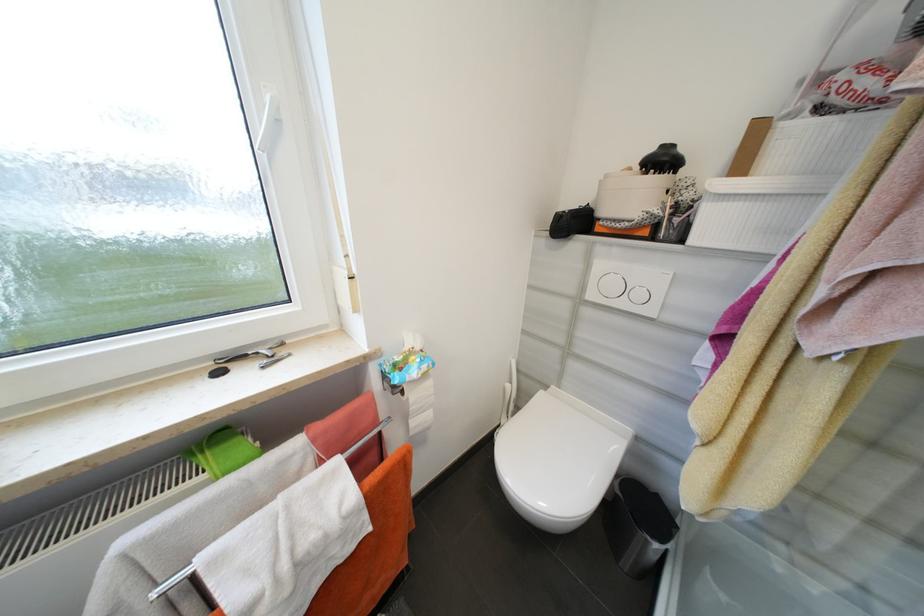
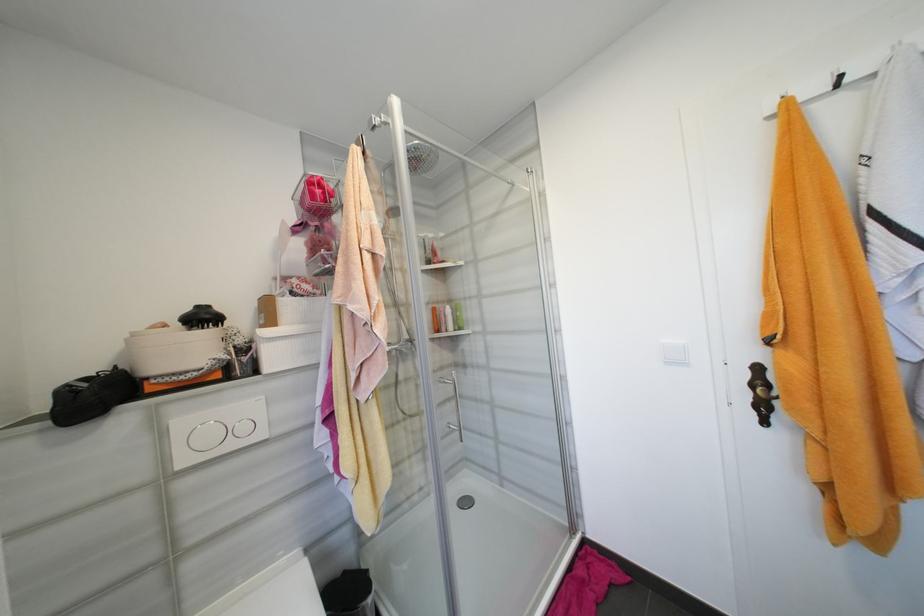
Locate, in the second image, the point that corresponds to point (667, 163) in the first image.

(210, 318)